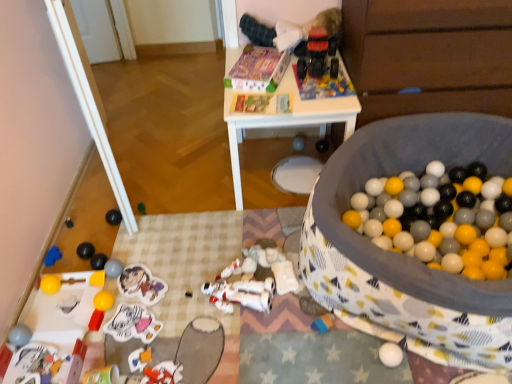
Locate an element on the screen. free space to the left of soft fabric ball pit at center, the 21th toy from the left is located at coordinates (216, 283).